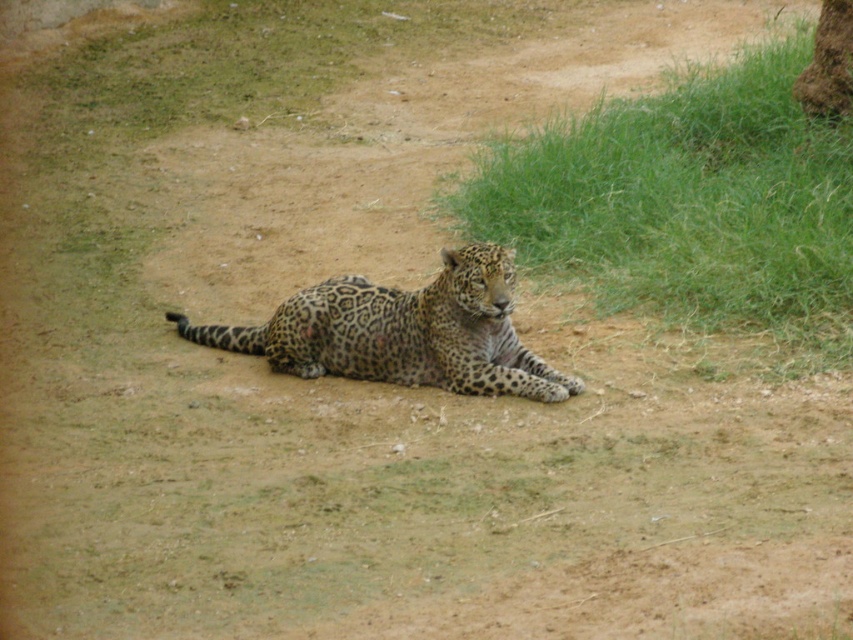
You are a wildlife photographer aiming to capture a closeup of the green grass at center while keeping the spotted fur leopard at center in the background. Based on the scene description, what is the minimum distance your camera should be from the leopard to achieve this?

The green grass at center is 1.70 meters from the spotted fur leopard at center. To ensure the leopard is in the background while focusing on the grass, the camera should be positioned at least 1.70 meters away from the leopard.

Based on the scene description, is the green grass at center wider than the spotted fur leopard at center?

The green grass at center might be wider than the spotted fur leopard at center according to the description provided.

You are a wildlife photographer aiming to capture the leopard in the image. You want to position your camera so that the leopard is centered in the frame. Given that the green grass at center is located at coordinates point 0.316, 0.808, where should you place your camera to ensure the leopard is centered?

To center the leopard in the frame, position the camera so that the leopard aligns with the center point of the image, which is at coordinates point (688,202) where the green grass at center is located.